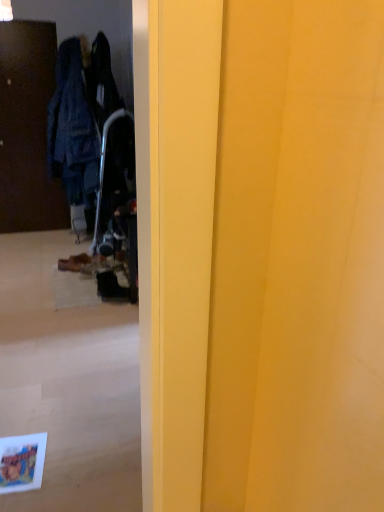
The width and height of the screenshot is (384, 512). Identify the location of brown suede shoe at lower left. (74, 263).

The image size is (384, 512). What do you see at coordinates (74, 263) in the screenshot?
I see `brown suede shoe at lower left` at bounding box center [74, 263].

Describe the element at coordinates (28, 129) in the screenshot. I see `dark wood door at left` at that location.

Locate an element on the screen. The height and width of the screenshot is (512, 384). dark wood door at left is located at coordinates (28, 129).

What is the approximate width of dark wood door at left?

dark wood door at left is 3.09 inches in width.

Image resolution: width=384 pixels, height=512 pixels. Identify the location of brown suede shoe at lower left. (74, 263).

Consider the image. Does brown suede shoe at lower left appear on the left side of dark wood door at left?

In fact, brown suede shoe at lower left is to the right of dark wood door at left.

Which object is closer to the camera, brown suede shoe at lower left or dark wood door at left?

brown suede shoe at lower left.

Which is farther from the camera, (x=78, y=267) or (x=23, y=136)?

The point (x=23, y=136) is more distant.

From the image's perspective, would you say brown suede shoe at lower left is shown under dark wood door at left?

Correct, brown suede shoe at lower left appears lower than dark wood door at left in the image.

From a real-world perspective, is brown suede shoe at lower left positioned over dark wood door at left based on gravity?

No, from a real-world perspective, brown suede shoe at lower left is not above dark wood door at left.

Can you confirm if brown suede shoe at lower left is thinner than dark wood door at left?

In fact, brown suede shoe at lower left might be wider than dark wood door at left.

Can you confirm if brown suede shoe at lower left is shorter than dark wood door at left?

Correct, brown suede shoe at lower left is not as tall as dark wood door at left.

From the picture: Is brown suede shoe at lower left bigger or smaller than dark wood door at left?

In the image, brown suede shoe at lower left appears to be smaller than dark wood door at left.

Is brown suede shoe at lower left not within dark wood door at left?

Yes, brown suede shoe at lower left is outside of dark wood door at left.

In the scene shown: Is brown suede shoe at lower left next to dark wood door at left?

No, brown suede shoe at lower left is not beside dark wood door at left.

Is dark wood door at left at the back of brown suede shoe at lower left?

No, brown suede shoe at lower left's orientation is not away from dark wood door at left.

You are a GUI agent. You are given a task and a screenshot of the screen. Output one action in this format:
    pyautogui.click(x=<x>, y=<y>)
    Task: Click on the door behind the brown suede shoe at lower left
    The height and width of the screenshot is (512, 384).
    Given the screenshot: What is the action you would take?
    pyautogui.click(x=28, y=129)

Which is more to the left, dark wood door at left or brown suede shoe at lower left?

Positioned to the left is dark wood door at left.

Does dark wood door at left come behind brown suede shoe at lower left?

Yes.

Is point (13, 35) closer or farther from the camera than point (64, 265)?

Point (13, 35) is farther from the camera than point (64, 265).

From the image's perspective, is dark wood door at left under brown suede shoe at lower left?

Actually, dark wood door at left appears above brown suede shoe at lower left in the image.

From a real-world perspective, which is physically above, dark wood door at left or brown suede shoe at lower left?

dark wood door at left is physically above.

Can you confirm if dark wood door at left is thinner than brown suede shoe at lower left?

Yes.

Which of these two, dark wood door at left or brown suede shoe at lower left, stands shorter?

With less height is brown suede shoe at lower left.

Can you confirm if dark wood door at left is bigger than brown suede shoe at lower left?

Indeed, dark wood door at left has a larger size compared to brown suede shoe at lower left.

Is dark wood door at left spatially inside brown suede shoe at lower left, or outside of it?

The correct answer is: outside.

Consider the image. Is dark wood door at left touching brown suede shoe at lower left?

No, dark wood door at left is not next to brown suede shoe at lower left.

Is brown suede shoe at lower left at the back of dark wood door at left?

No, dark wood door at left is not facing the opposite direction of brown suede shoe at lower left.

Locate an element on the screen. This screenshot has height=512, width=384. footwear on the right of dark wood door at left is located at coordinates (74, 263).

Where is `footwear to the right of dark wood door at left`? footwear to the right of dark wood door at left is located at coordinates (74, 263).

Find the location of a particular element. Image resolution: width=384 pixels, height=512 pixels. door behind the brown suede shoe at lower left is located at coordinates (28, 129).